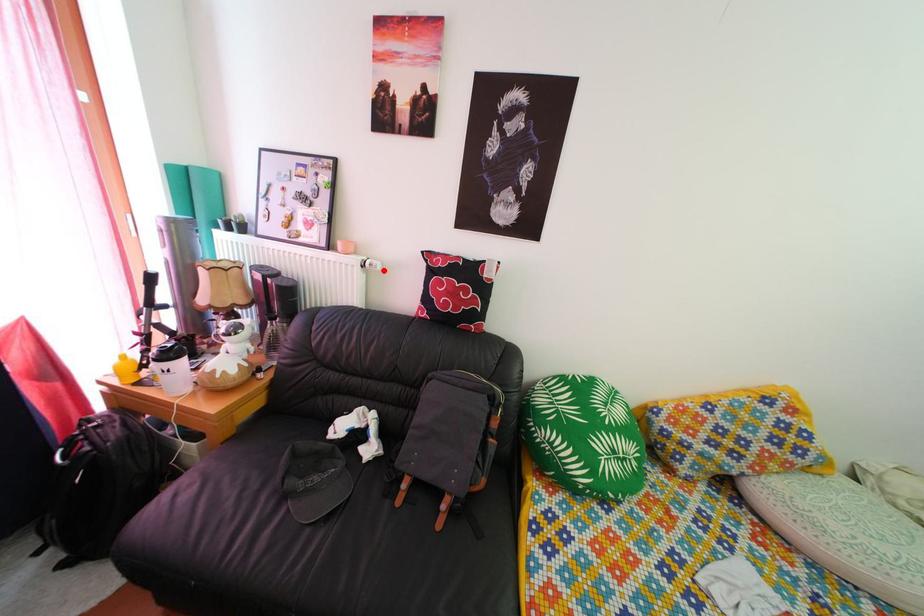
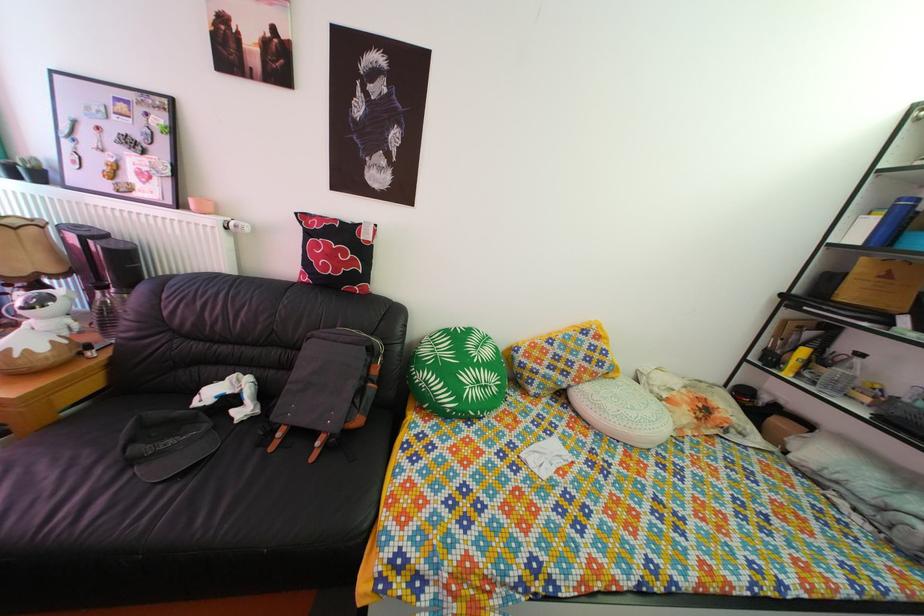
Question: I am providing you with two images of the same scene from different viewpoints. Image1 has a red point marked. In image2, the corresponding 3D location appears at what relative position? Reply with the corresponding letter.

Choices:
 (A) Closer
 (B) Farther

Answer: (B)